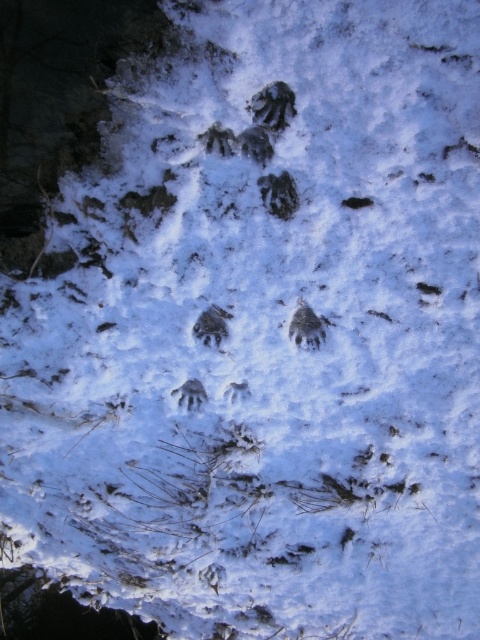
Who is positioned more to the right, brown fur at center or dark fur paw print at center?

Positioned to the right is brown fur at center.

Describe the element at coordinates (307, 324) in the screenshot. I see `brown fur at center` at that location.

Find the location of a particular element. brown fur at center is located at coordinates (307, 324).